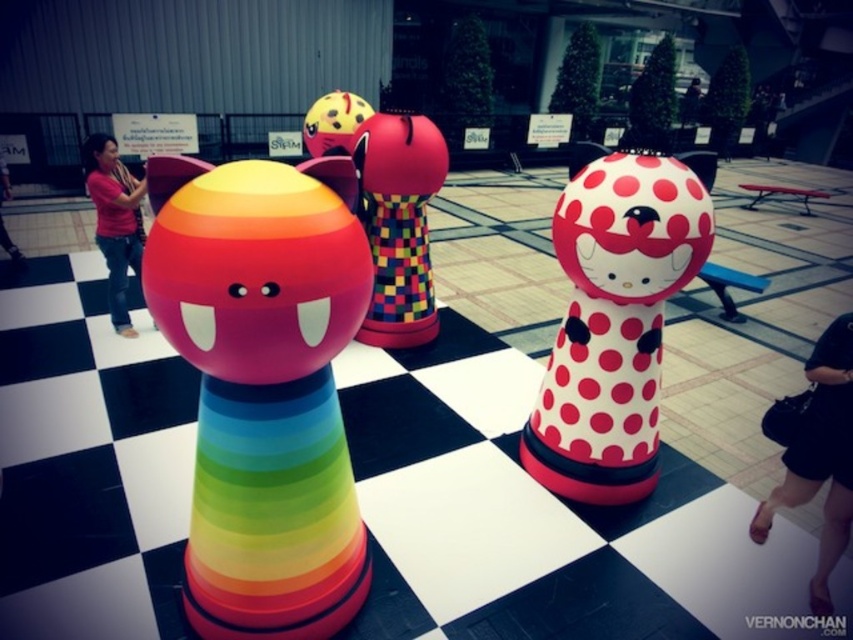
You are standing at the origin point of the scene. Which of the two points, point (329,108) or point (7,186), is closer to you?

Point (329,108) is in front of point (7,186), so it is closer to you.

You are standing in the center of the checkered floor and want to place a new sculpture exactly between the rainbow figure and the black leather shoes at lower right. Which direction should you move from the rainbow figure to reach the midpoint?

The black leather shoes at lower right is located at point (819,456), so you should move towards the lower right direction from the rainbow figure to reach the midpoint.